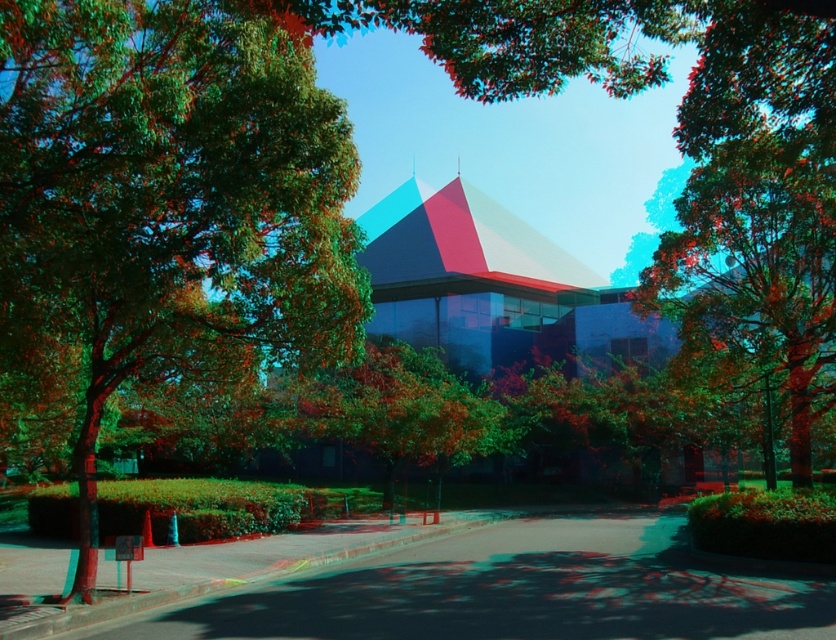
Question: Which object is closer to the camera taking this photo?

Choices:
 (A) green leafy tree at left
 (B) green leafy tree at center

Answer: (A)

Question: Is green leafy tree at left smaller than green leafy tree at center?

Choices:
 (A) yes
 (B) no

Answer: (A)

Question: Is green leafy tree at left positioned behind green leafy tree at center?

Choices:
 (A) no
 (B) yes

Answer: (A)

Question: Among these points, which one is nearest to the camera?

Choices:
 (A) (803, 147)
 (B) (257, 157)

Answer: (B)

Question: Does green leafy tree at left have a greater width compared to green leafy tree at center?

Choices:
 (A) yes
 (B) no

Answer: (B)

Question: Which object is farther from the camera taking this photo?

Choices:
 (A) green leafy tree at left
 (B) green leafy tree at center

Answer: (B)